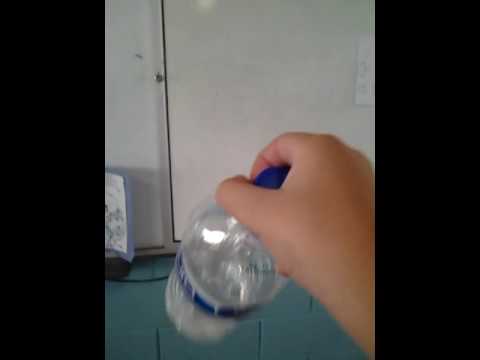
Where is `wall`? This screenshot has height=360, width=480. wall is located at coordinates (244, 111).